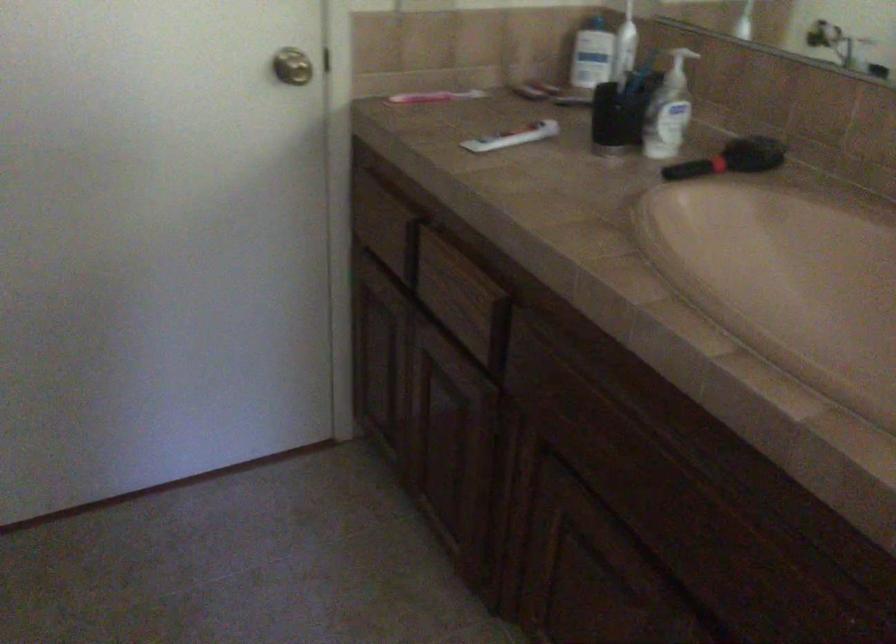
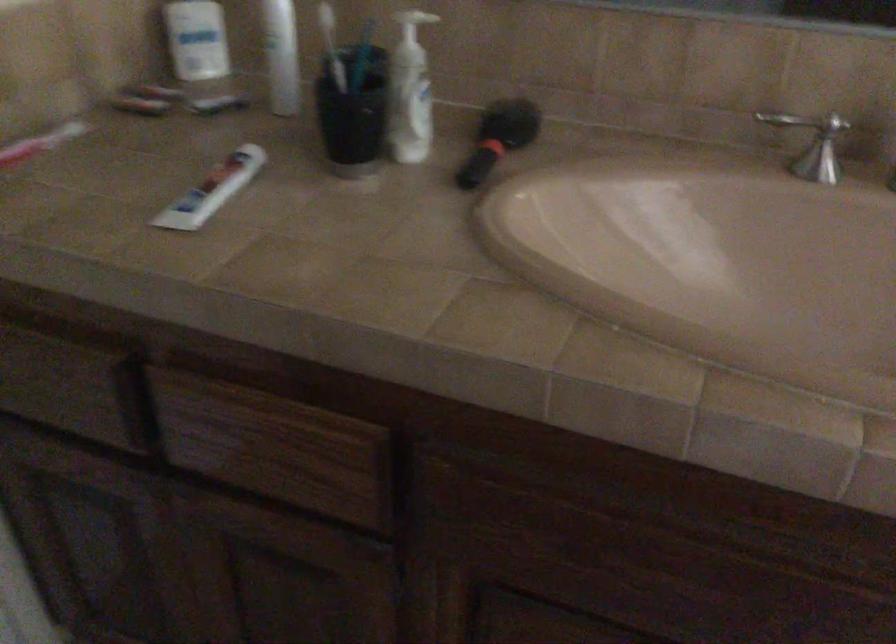
Locate, in the second image, the point that corresponds to pixel 493 270 in the first image.

(341, 404)